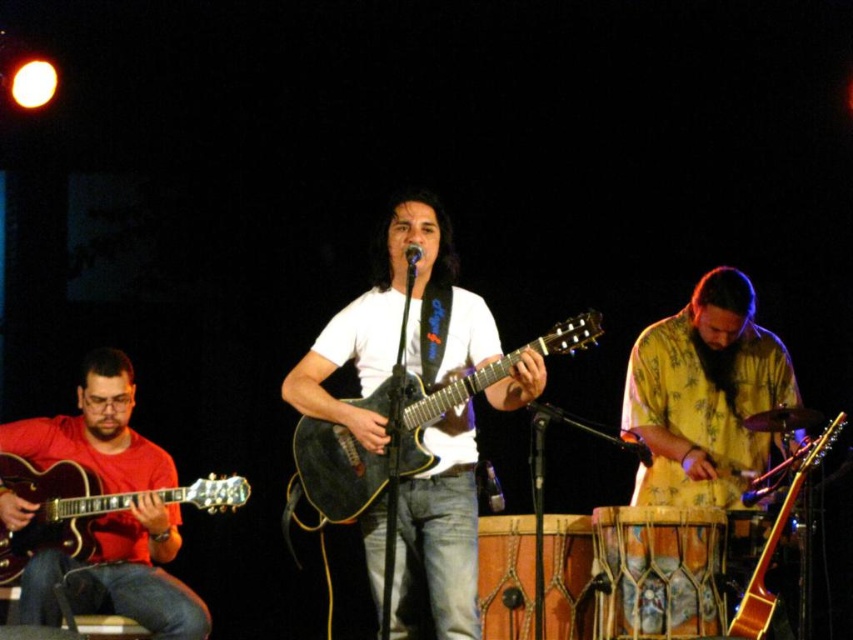
Is glossy black guitar at center below shiny black electric guitar at left?

No.

Who is taller, glossy black guitar at center or shiny black electric guitar at left?

glossy black guitar at center

Between point (579, 348) and point (9, 547), which one is positioned in front?

Positioned in front is point (579, 348).

The height and width of the screenshot is (640, 853). What are the coordinates of `glossy black guitar at center` in the screenshot? It's located at (404, 426).

Who is higher up, yellow floral shirt at center or glossy black guitar at center?

yellow floral shirt at center

Find the location of a particular element. The height and width of the screenshot is (640, 853). yellow floral shirt at center is located at coordinates (705, 396).

Image resolution: width=853 pixels, height=640 pixels. In order to click on yellow floral shirt at center in this screenshot , I will do `click(705, 396)`.

Can you confirm if white matte guitar at center is positioned to the right of glossy black guitar at center?

In fact, white matte guitar at center is to the left of glossy black guitar at center.

Image resolution: width=853 pixels, height=640 pixels. In order to click on white matte guitar at center in this screenshot , I will do `click(398, 324)`.